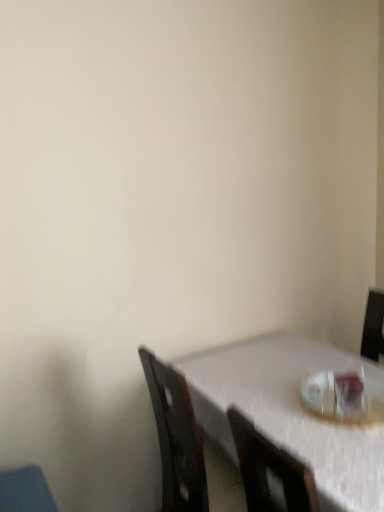
In the scene shown: What is the approximate width of transparent plastic cup at lower right?

transparent plastic cup at lower right is 12.14 inches wide.

Describe the element at coordinates (340, 396) in the screenshot. I see `transparent plastic cup at lower right` at that location.

This screenshot has height=512, width=384. Identify the location of transparent plastic cup at lower right. (340, 396).

Describe the element at coordinates (290, 412) in the screenshot. The height and width of the screenshot is (512, 384). I see `white textured table at lower right` at that location.

Identify the location of white textured table at lower right. (290, 412).

The height and width of the screenshot is (512, 384). What are the coordinates of `transparent plastic cup at lower right` in the screenshot? It's located at (340, 396).

Between white textured table at lower right and transparent plastic cup at lower right, which one appears on the right side from the viewer's perspective?

transparent plastic cup at lower right is more to the right.

Between white textured table at lower right and transparent plastic cup at lower right, which one is positioned behind?

transparent plastic cup at lower right is further from the camera.

Which point is more distant from viewer, (241, 362) or (319, 390)?

The point (241, 362) is farther from the camera.

From the image's perspective, relative to transparent plastic cup at lower right, is white textured table at lower right above or below?

white textured table at lower right is below transparent plastic cup at lower right.

From a real-world perspective, is white textured table at lower right positioned over transparent plastic cup at lower right based on gravity?

No, from a real-world perspective, white textured table at lower right is not over transparent plastic cup at lower right

In the scene shown: Considering the relative sizes of white textured table at lower right and transparent plastic cup at lower right in the image provided, is white textured table at lower right thinner than transparent plastic cup at lower right?

No.

In the scene shown: Considering the relative sizes of white textured table at lower right and transparent plastic cup at lower right in the image provided, is white textured table at lower right taller than transparent plastic cup at lower right?

Correct, white textured table at lower right is much taller as transparent plastic cup at lower right.

Who is smaller, white textured table at lower right or transparent plastic cup at lower right?

With smaller size is transparent plastic cup at lower right.

Choose the correct answer: Is white textured table at lower right inside transparent plastic cup at lower right or outside it?

white textured table at lower right is outside transparent plastic cup at lower right.

Is the surface of white textured table at lower right in direct contact with transparent plastic cup at lower right?

They are not placed beside each other.

Is white textured table at lower right facing away from transparent plastic cup at lower right?

white textured table at lower right does not have its back to transparent plastic cup at lower right.

The height and width of the screenshot is (512, 384). What are the coordinates of `table that is on the left side of transparent plastic cup at lower right` in the screenshot? It's located at (290, 412).

Is transparent plastic cup at lower right at the right side of white textured table at lower right?

Yes.

Which object is further away from the camera, transparent plastic cup at lower right or white textured table at lower right?

Positioned behind is transparent plastic cup at lower right.

Does point (311, 382) lie behind point (252, 344)?

That is False.

From the image's perspective, is transparent plastic cup at lower right above or below white textured table at lower right?

From the image's perspective, transparent plastic cup at lower right appears above white textured table at lower right.

From a real-world perspective, which object rests below the other?

white textured table at lower right, from a real-world perspective.

Considering the sizes of objects transparent plastic cup at lower right and white textured table at lower right in the image provided, who is wider, transparent plastic cup at lower right or white textured table at lower right?

Wider between the two is white textured table at lower right.

From the picture: Is transparent plastic cup at lower right taller than white textured table at lower right?

In fact, transparent plastic cup at lower right may be shorter than white textured table at lower right.

Does transparent plastic cup at lower right have a smaller size compared to white textured table at lower right?

Indeed, transparent plastic cup at lower right has a smaller size compared to white textured table at lower right.

Is transparent plastic cup at lower right inside or outside of white textured table at lower right?

transparent plastic cup at lower right is inside white textured table at lower right.

Is transparent plastic cup at lower right next to white textured table at lower right?

No, transparent plastic cup at lower right is not next to white textured table at lower right.

Is white textured table at lower right at the back of transparent plastic cup at lower right?

That's not correct — transparent plastic cup at lower right is not looking away from white textured table at lower right.

Can you tell me how much transparent plastic cup at lower right and white textured table at lower right differ in facing direction?

1.07 degrees separate the facing orientations of transparent plastic cup at lower right and white textured table at lower right.

What are the coordinates of `table on the left of transparent plastic cup at lower right` in the screenshot? It's located at (290, 412).

Identify the location of table that is on the left side of transparent plastic cup at lower right. (290, 412).

Image resolution: width=384 pixels, height=512 pixels. In order to click on table below the transparent plastic cup at lower right (from the image's perspective) in this screenshot , I will do `click(290, 412)`.